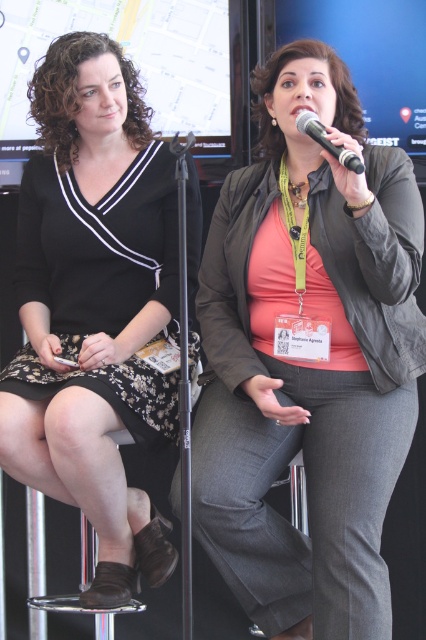
Consider the image. Is black floral dress at left positioned before black plastic microphone at upper center?

That is False.

Which of these two, black floral dress at left or black plastic microphone at upper center, stands shorter?

Standing shorter between the two is black plastic microphone at upper center.

Who is more forward, (89,132) or (337,152)?

Positioned in front is point (337,152).

Where is `black floral dress at left`? The image size is (426, 640). black floral dress at left is located at coordinates (94, 307).

In the scene shown: Can you confirm if orange matte shirt at center is positioned to the right of black floral dress at left?

Correct, you'll find orange matte shirt at center to the right of black floral dress at left.

Which of these two, orange matte shirt at center or black floral dress at left, stands shorter?

With less height is orange matte shirt at center.

Who is more forward, (209, 456) or (166, 198)?

Point (209, 456) is more forward.

Find the location of a particular element. The width and height of the screenshot is (426, 640). orange matte shirt at center is located at coordinates (308, 362).

Looking at this image, can you confirm if orange matte shirt at center is positioned above black plastic microphone at upper center?

Actually, orange matte shirt at center is below black plastic microphone at upper center.

At what (x,y) coordinates should I click in order to perform the action: click on orange matte shirt at center. Please return your answer as a coordinate pair (x, y). Looking at the image, I should click on (308, 362).